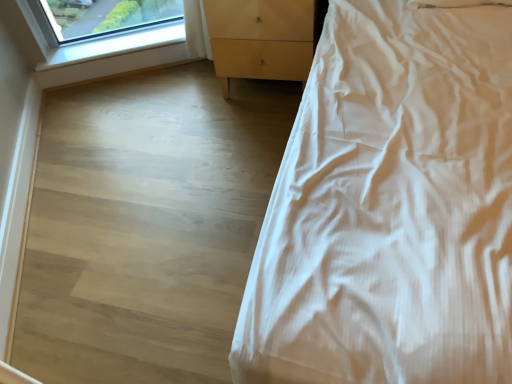
Question: Is light wood/texture chest of drawers at center wider than white smooth bed at right?

Choices:
 (A) no
 (B) yes

Answer: (A)

Question: From a real-world perspective, is light wood/texture chest of drawers at center over white smooth bed at right?

Choices:
 (A) no
 (B) yes

Answer: (A)

Question: From the image's perspective, is light wood/texture chest of drawers at center over white smooth bed at right?

Choices:
 (A) yes
 (B) no

Answer: (A)

Question: From a real-world perspective, is light wood/texture chest of drawers at center beneath white smooth bed at right?

Choices:
 (A) yes
 (B) no

Answer: (A)

Question: Is white smooth bed at right at the back of light wood/texture chest of drawers at center?

Choices:
 (A) no
 (B) yes

Answer: (A)

Question: Visually, is white smooth bed at right positioned to the left or to the right of light wood at upper left?

Choices:
 (A) right
 (B) left

Answer: (A)

Question: Considering the positions of point (270, 302) and point (71, 66), is point (270, 302) closer or farther from the camera than point (71, 66)?

Choices:
 (A) closer
 (B) farther

Answer: (A)

Question: From a real-world perspective, is white smooth bed at right positioned above or below light wood at upper left?

Choices:
 (A) below
 (B) above

Answer: (B)

Question: Is white smooth bed at right in front of or behind light wood at upper left in the image?

Choices:
 (A) behind
 (B) front

Answer: (B)

Question: Is point (113, 59) closer or farther from the camera than point (224, 74)?

Choices:
 (A) closer
 (B) farther

Answer: (B)

Question: Based on their sizes in the image, would you say light wood at upper left is bigger or smaller than light wood/texture chest of drawers at center?

Choices:
 (A) big
 (B) small

Answer: (B)

Question: In terms of height, does light wood at upper left look taller or shorter compared to light wood/texture chest of drawers at center?

Choices:
 (A) short
 (B) tall

Answer: (A)

Question: Is light wood at upper left inside or outside of light wood/texture chest of drawers at center?

Choices:
 (A) inside
 (B) outside

Answer: (B)

Question: In terms of size, does light wood/texture chest of drawers at center appear bigger or smaller than light wood at upper left?

Choices:
 (A) big
 (B) small

Answer: (A)

Question: From the image's perspective, is light wood/texture chest of drawers at center above or below light wood at upper left?

Choices:
 (A) below
 (B) above

Answer: (B)